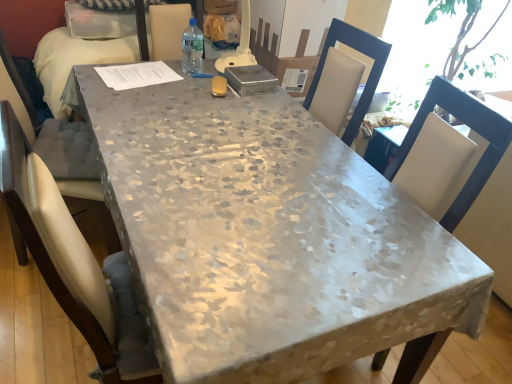
Measure the distance between point (187, 67) and camera.

They are 6.09 feet apart.

Where is `white fabric chair at right`? The height and width of the screenshot is (384, 512). white fabric chair at right is located at coordinates (471, 128).

Considering the positions of point (194, 27) and point (436, 99), is point (194, 27) closer or farther from the camera than point (436, 99)?

Point (194, 27) is positioned farther from the camera compared to point (436, 99).

Who is taller, clear plastic bottle at center or white fabric chair at right?

Standing taller between the two is white fabric chair at right.

This screenshot has height=384, width=512. What are the coordinates of `bottle that appears above the white fabric chair at right (from a real-world perspective)` in the screenshot? It's located at (192, 48).

From the picture: From the image's perspective, is clear plastic bottle at center positioned above or below white fabric chair at right?

Clearly, from the image's perspective, clear plastic bottle at center is above white fabric chair at right.

How much distance is there between floral-patterned fabric table at center and white fabric chair at right?

floral-patterned fabric table at center and white fabric chair at right are 55.69 centimeters apart.

Would you say white fabric chair at right is part of floral-patterned fabric table at center's contents?

No, white fabric chair at right is not surrounded by floral-patterned fabric table at center.

From a real-world perspective, which is physically above, floral-patterned fabric table at center or white fabric chair at right?

floral-patterned fabric table at center, from a real-world perspective.

How many degrees apart are the facing directions of floral-patterned fabric table at center and white fabric chair at right?

There is a 90.2-degree angle between the facing directions of floral-patterned fabric table at center and white fabric chair at right.

From a real-world perspective, who is located lower, clear plastic bottle at center or floral-patterned fabric table at center?

floral-patterned fabric table at center.

Considering the relative sizes of clear plastic bottle at center and floral-patterned fabric table at center in the image provided, is clear plastic bottle at center thinner than floral-patterned fabric table at center?

Yes, clear plastic bottle at center is thinner than floral-patterned fabric table at center.

Considering the positions of point (189, 61) and point (367, 251), is point (189, 61) closer or farther from the camera than point (367, 251)?

Clearly, point (189, 61) is more distant from the camera than point (367, 251).

From the image's perspective, is clear plastic bottle at center located beneath floral-patterned fabric table at center?

No, from the image's perspective, clear plastic bottle at center is not below floral-patterned fabric table at center.

Identify the location of chair on the right of floral-patterned fabric table at center. (471, 128).

Is white fabric chair at right bigger than floral-patterned fabric table at center?

Incorrect, white fabric chair at right is not larger than floral-patterned fabric table at center.

Considering the relative sizes of white fabric chair at right and floral-patterned fabric table at center in the image provided, is white fabric chair at right taller than floral-patterned fabric table at center?

Yes, white fabric chair at right is taller than floral-patterned fabric table at center.

Is point (426, 97) farther from viewer compared to point (320, 149)?

No, (426, 97) is closer to viewer.

Is floral-patterned fabric table at center closer to camera compared to clear plastic bottle at center?

Yes, floral-patterned fabric table at center is closer to the viewer.

Considering the relative sizes of floral-patterned fabric table at center and clear plastic bottle at center in the image provided, is floral-patterned fabric table at center wider than clear plastic bottle at center?

Yes.

Can you confirm if floral-patterned fabric table at center is positioned to the left of clear plastic bottle at center?

No.

Is point (413, 124) positioned after point (192, 58)?

No, (413, 124) is closer to viewer.

Between white fabric chair at right and clear plastic bottle at center, which one is positioned behind?

A: clear plastic bottle at center is behind.

From the image's perspective, would you say white fabric chair at right is shown under clear plastic bottle at center?

Yes.

Locate an element on the screen. bottle above the white fabric chair at right (from a real-world perspective) is located at coordinates (192, 48).

You are a GUI agent. You are given a task and a screenshot of the screen. Output one action in this format:
    pyautogui.click(x=<x>, y=<y>)
    Task: Click on the chair behind the floral-patterned fabric table at center
    
    Given the screenshot: What is the action you would take?
    pyautogui.click(x=471, y=128)

Looking at the image, which one is located closer to white fabric chair at right, floral-patterned fabric table at center or clear plastic bottle at center?

Among the two, floral-patterned fabric table at center is located nearer to white fabric chair at right.

Based on their spatial positions, is clear plastic bottle at center or floral-patterned fabric table at center further from white fabric chair at right?

Among the two, clear plastic bottle at center is located further to white fabric chair at right.

Looking at the image, which one is located closer to clear plastic bottle at center, floral-patterned fabric table at center or white fabric chair at right?

floral-patterned fabric table at center lies closer to clear plastic bottle at center than the other object.

When comparing their distances from floral-patterned fabric table at center, does clear plastic bottle at center or white fabric chair at right seem closer?

white fabric chair at right is positioned closer to the anchor floral-patterned fabric table at center.

Considering their positions, is white fabric chair at right positioned further to clear plastic bottle at center than floral-patterned fabric table at center?

white fabric chair at right lies further to clear plastic bottle at center than the other object.

Based on their spatial positions, is white fabric chair at right or clear plastic bottle at center further from floral-patterned fabric table at center?

clear plastic bottle at center is positioned further to the anchor floral-patterned fabric table at center.

You are a GUI agent. You are given a task and a screenshot of the screen. Output one action in this format:
    pyautogui.click(x=<x>, y=<y>)
    Task: Click on the table situated between clear plastic bottle at center and white fabric chair at right from left to right
    The image size is (512, 384).
    Given the screenshot: What is the action you would take?
    pyautogui.click(x=267, y=236)